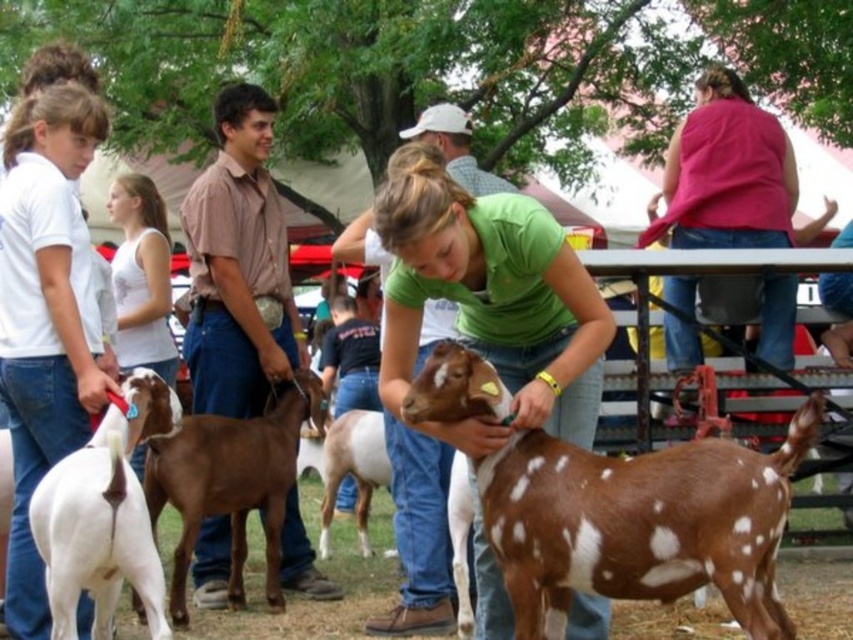
You are a photographer standing at the edge of the fairground. You want to take a photo of the green matte shirt at center and the white matte goat at left. If your camera has a maximum focus range of 1.8 meters, will both subjects be in focus?

The green matte shirt at center is 1.84 meters from the white matte goat at left. Since the distance between them is slightly over the camera maximum focus range of 1.8 meters, the camera may not be able to keep both subjects in focus simultaneously.

In the scene shown: You are standing at the edge of the fairground and want to walk towards the green matte shirt at center. There is a white matte goat at left in your path. Can you pass between them without getting too close to either?

The green matte shirt at center might be wider than the white matte goat at left, so there may be enough space to pass between them without getting too close to either.

You are a photographer trying to capture a closeup of the brown spotted fur at center. If your camera has a minimum focusing distance of 10 feet, will you be able to take the photo without moving closer?

The brown spotted fur at center is 10.06 feet from camera. Since the minimum focusing distance is 10 feet, the photographer can take the photo without moving closer because the distance is just slightly beyond the required minimum.